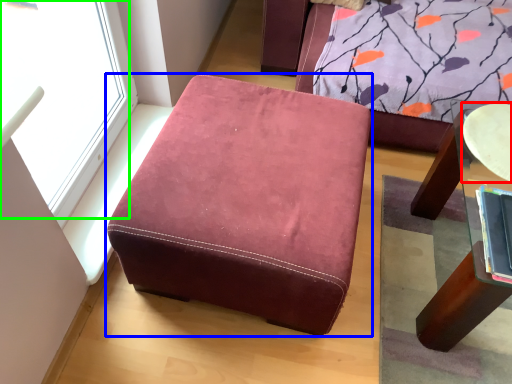
Question: Considering the real-world distances, which object is farthest from round table (highlighted by a red box)? furniture (highlighted by a blue box) or window (highlighted by a green box)?

Choices:
 (A) furniture
 (B) window

Answer: (B)